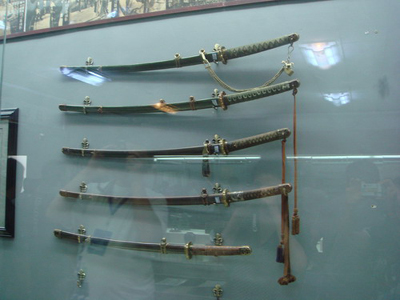
I want to click on handle, so click(x=269, y=45).